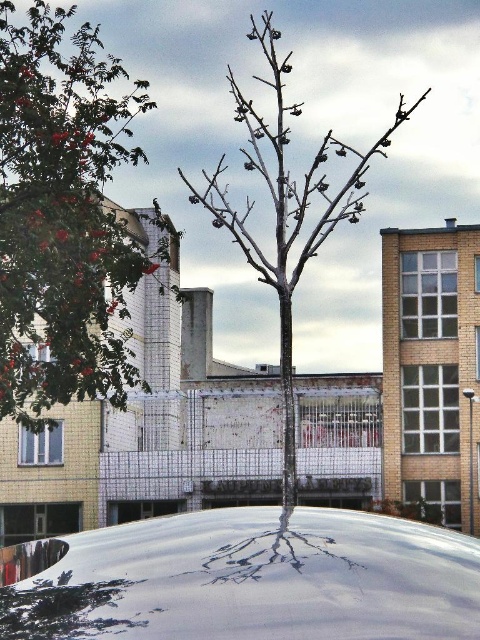
Question: Estimate the real-world distances between objects in this image. Which object is closer to the white glossy car at center?

Choices:
 (A) smooth gray tree at center
 (B) red glossy tree at upper left

Answer: (B)

Question: Does red glossy tree at upper left come in front of smooth gray tree at center?

Choices:
 (A) no
 (B) yes

Answer: (A)

Question: Estimate the real-world distances between objects in this image. Which object is closer to the red glossy tree at upper left?

Choices:
 (A) white glossy car at center
 (B) smooth gray tree at center

Answer: (B)

Question: Among these objects, which one is farthest from the camera?

Choices:
 (A) smooth gray tree at center
 (B) red glossy tree at upper left

Answer: (B)

Question: Does red glossy tree at upper left appear over smooth gray tree at center?

Choices:
 (A) no
 (B) yes

Answer: (B)

Question: Considering the relative positions of red glossy tree at upper left and smooth gray tree at center in the image provided, where is red glossy tree at upper left located with respect to smooth gray tree at center?

Choices:
 (A) below
 (B) above

Answer: (B)